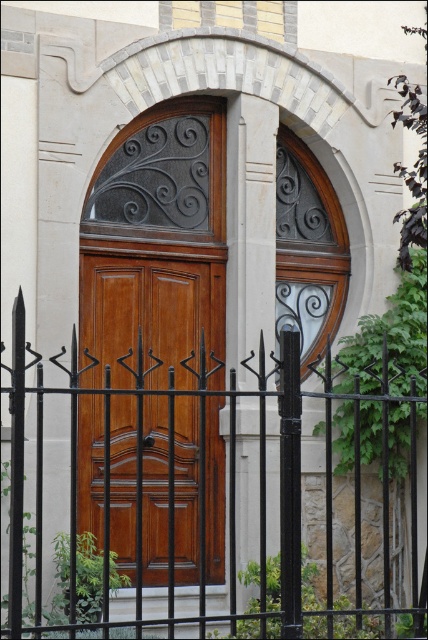
You are a delivery person trying to deliver a package to the address in front of the wooden door at center. However, there is a black wrought iron fence at center blocking your path. Can you walk through the fence to reach the door?

The black wrought iron fence at center is not as tall as wooden door at center, so it is possible to walk through the fence to reach the wooden door at center since the fence is shorter than the door.

You are standing in front of the building and want to enter through the wooden door at center. However, there is a black wrought iron fence at center blocking your path. Which direction should you move to get around the fence and reach the door?

The black wrought iron fence at center is to the right of the wooden door at center. To reach the door, move to the left side of the fence since it is positioned to the right of the door, allowing you to bypass it by going around the left.

You are a delivery person approaching the building and need to reach the wooden door at center. There is a black wrought iron fence at center in your way. Can you walk through the fence to reach the door?

The black wrought iron fence at center is in front of the wooden door at center, so you cannot walk through the fence to reach the door. You need to find another path or gate around the fence.